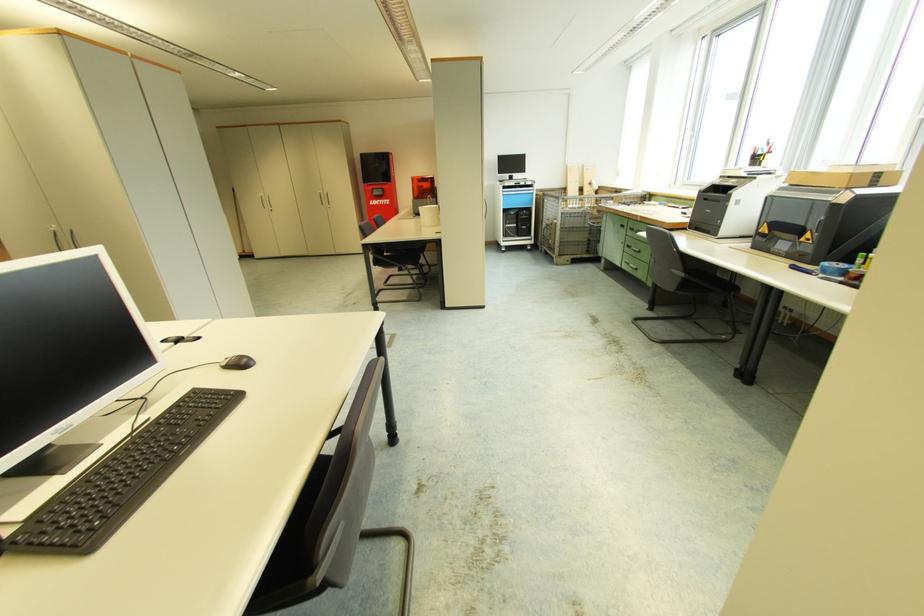
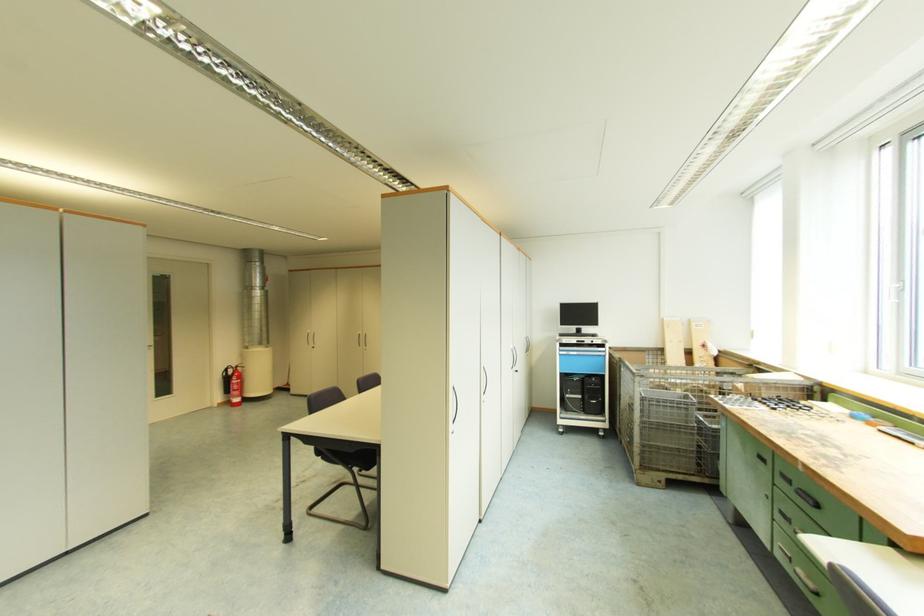
In the scene shown: Which direction would the cameraman need to move to produce the second image?

The cameraman moved toward right, forward.